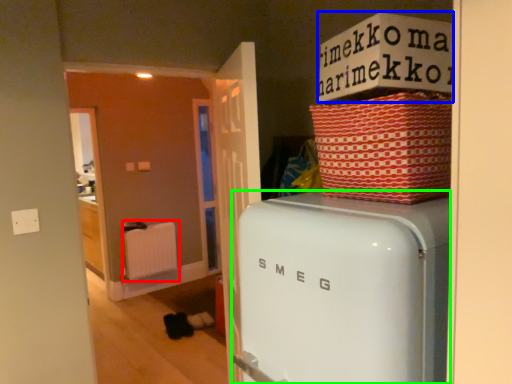
Question: Which object is the farthest from radiator (highlighted by a red box)? Choose among these: cardboard box (highlighted by a blue box) or home appliance (highlighted by a green box).

Choices:
 (A) cardboard box
 (B) home appliance

Answer: (A)